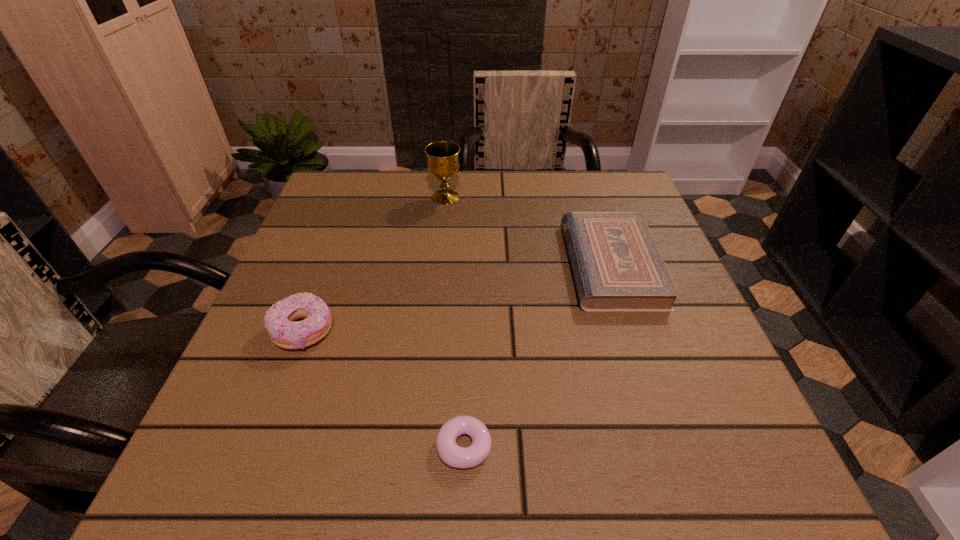
Locate an element on the screen. vacant space positioned on the spine side of the Bible is located at coordinates (413, 265).

This screenshot has width=960, height=540. Identify the location of vacant space located on the spine side of the Bible. (465, 265).

At what (x,y) coordinates should I click in order to perform the action: click on free point located on the spine side of the Bible. Please return your answer as a coordinate pair (x, y). The width and height of the screenshot is (960, 540). Looking at the image, I should click on (398, 265).

Where is `vacant space situated on the back of the shortest object`? vacant space situated on the back of the shortest object is located at coordinates (467, 348).

Where is `object situated at the far edge`? object situated at the far edge is located at coordinates pyautogui.click(x=443, y=163).

Image resolution: width=960 pixels, height=540 pixels. In order to click on object located at the near edge in this screenshot , I will do `click(453, 455)`.

Identify the location of object at the left edge. The height and width of the screenshot is (540, 960). (278, 320).

What are the coordinates of `object situated at the right edge` in the screenshot? It's located at (617, 266).

In order to click on free region at the far edge of the desktop in this screenshot , I will do `click(421, 176)`.

Locate an element on the screen. vacant region at the near edge of the desktop is located at coordinates (346, 467).